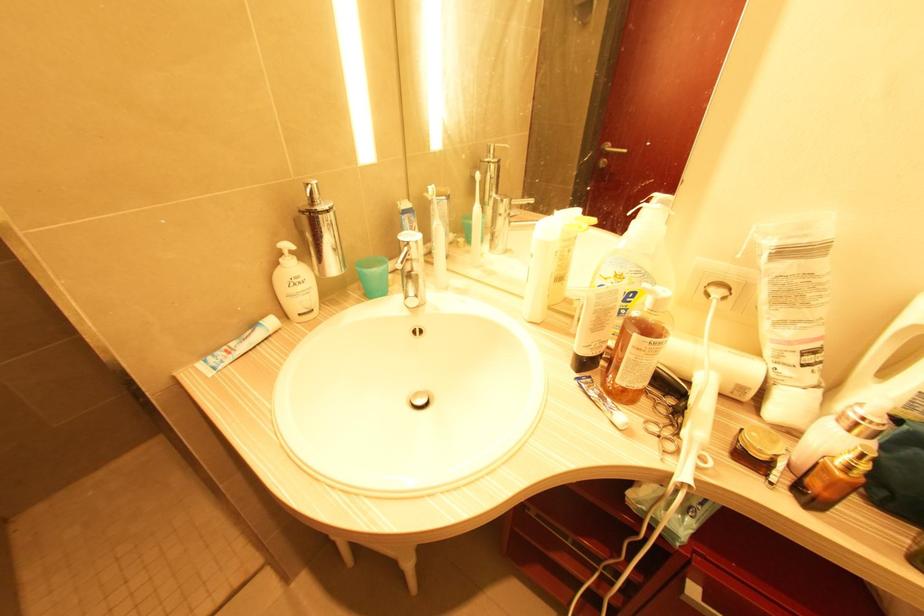
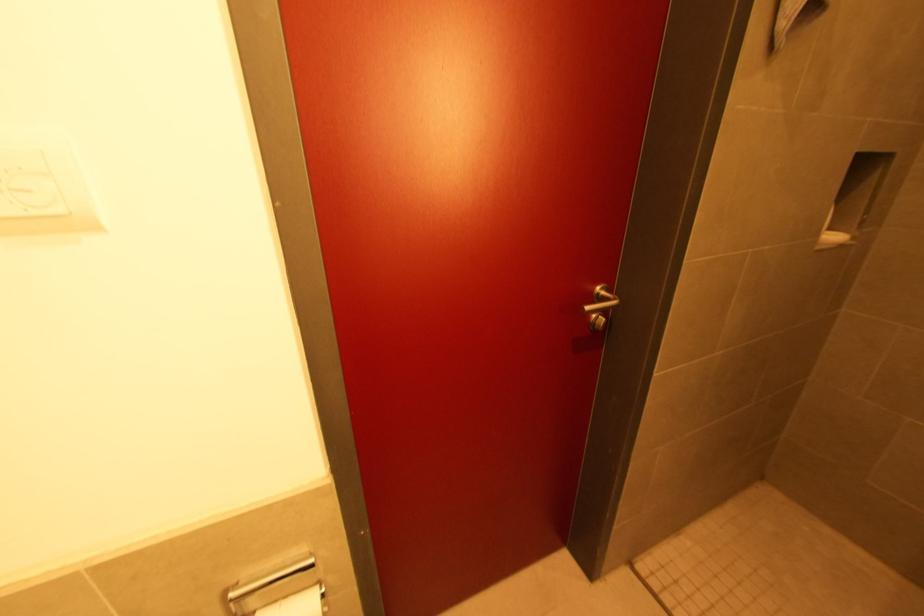
The images are taken continuously from a first-person perspective. In which direction is your viewpoint rotating?

The rotation direction of the camera is left-down.